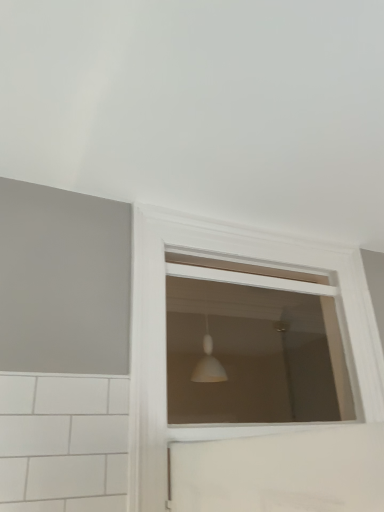
Question: Considering the relative positions of white matte window at center, which is the second window in bottom-to-top order, and white matte window at center, which is the 1th window from bottom to top, in the image provided, is white matte window at center, which is the second window in bottom-to-top order, in front of white matte window at center, which is the 1th window from bottom to top,?

Choices:
 (A) no
 (B) yes

Answer: (A)

Question: From the image's perspective, is white matte window at center, which is the second window in bottom-to-top order, below white matte window at center, placed as the 2th window when sorted from top to bottom?

Choices:
 (A) no
 (B) yes

Answer: (A)

Question: Is white matte window at center, acting as the 1th window starting from the top, in contact with white matte window at center, which is the 1th window from bottom to top?

Choices:
 (A) no
 (B) yes

Answer: (A)

Question: Is white matte window at center, acting as the 1th window starting from the top, bigger than white matte window at center, placed as the 2th window when sorted from top to bottom?

Choices:
 (A) no
 (B) yes

Answer: (A)

Question: Is white matte window at center, which is the second window in bottom-to-top order, aimed at white matte window at center, placed as the 2th window when sorted from top to bottom?

Choices:
 (A) no
 (B) yes

Answer: (B)

Question: Considering the relative sizes of white matte window at center, acting as the 1th window starting from the top, and white matte window at center, which is the 1th window from bottom to top, in the image provided, is white matte window at center, acting as the 1th window starting from the top, taller than white matte window at center, which is the 1th window from bottom to top,?

Choices:
 (A) yes
 (B) no

Answer: (B)

Question: Are white matte window at center, placed as the 2th window when sorted from top to bottom, and white matte window at center, acting as the 1th window starting from the top, far apart?

Choices:
 (A) no
 (B) yes

Answer: (B)

Question: From the image's perspective, is white matte window at center, placed as the 2th window when sorted from top to bottom, beneath white matte window at center, which is the second window in bottom-to-top order?

Choices:
 (A) yes
 (B) no

Answer: (A)

Question: Is white matte window at center, placed as the 2th window when sorted from top to bottom, beside white matte window at center, acting as the 1th window starting from the top?

Choices:
 (A) yes
 (B) no

Answer: (B)

Question: From the image's perspective, does white matte window at center, placed as the 2th window when sorted from top to bottom, appear higher than white matte window at center, which is the second window in bottom-to-top order?

Choices:
 (A) yes
 (B) no

Answer: (B)

Question: From a real-world perspective, is white matte window at center, which is the 1th window from bottom to top, positioned over white matte window at center, acting as the 1th window starting from the top, based on gravity?

Choices:
 (A) no
 (B) yes

Answer: (A)

Question: Can you confirm if white matte window at center, which is the 1th window from bottom to top, is positioned to the right of white matte window at center, acting as the 1th window starting from the top?

Choices:
 (A) no
 (B) yes

Answer: (B)

Question: Considering the positions of white matte window at center, which is the 1th window from bottom to top, and white matte window at center, acting as the 1th window starting from the top, in the image, is white matte window at center, which is the 1th window from bottom to top, taller or shorter than white matte window at center, acting as the 1th window starting from the top,?

Choices:
 (A) tall
 (B) short

Answer: (A)